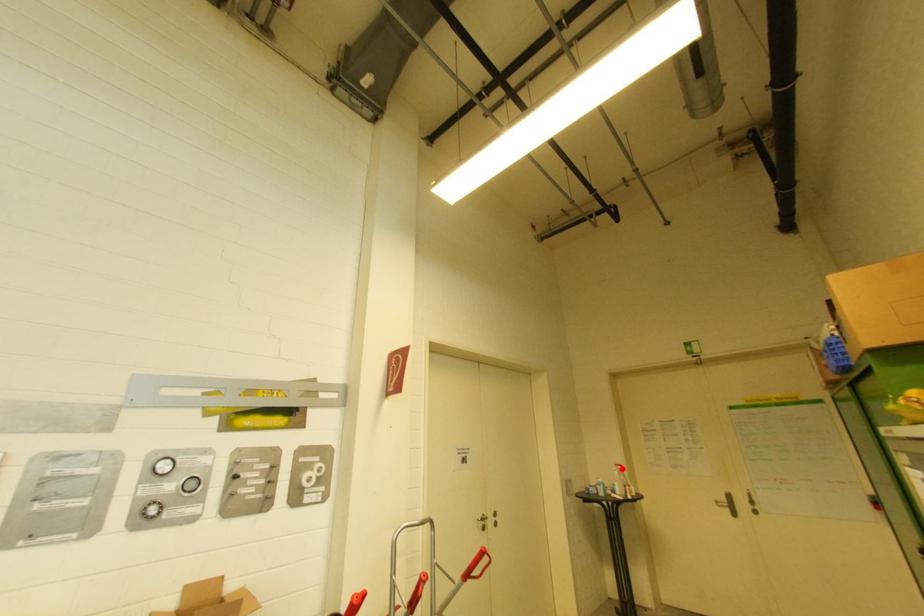
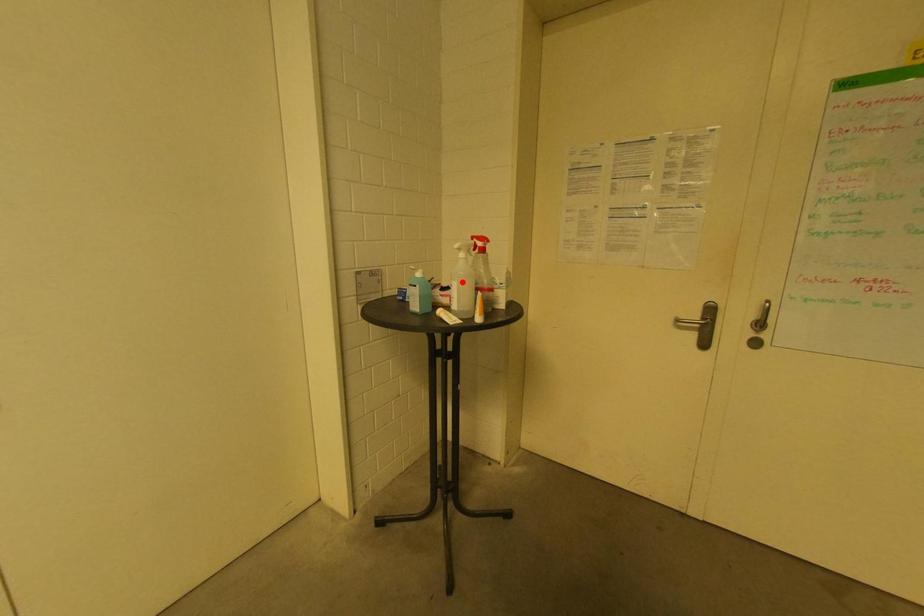
I am providing you with two images of the same scene from different viewpoints. A red point is marked on the first image and another point is marked on the second image. Is the marked point in image1 the same physical position as the marked point in image2?

No